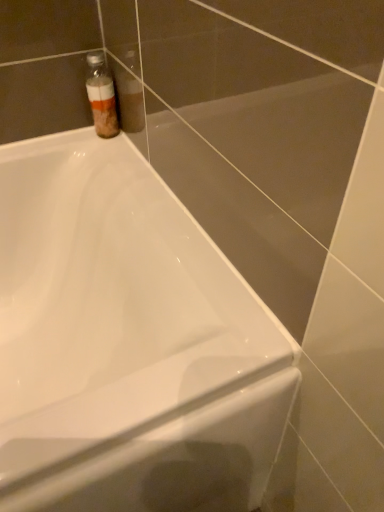
Question: In terms of width, does translucent plastic bottle at upper left look wider or thinner when compared to white glossy bathtub at upper left?

Choices:
 (A) wide
 (B) thin

Answer: (B)

Question: Choose the correct answer: Is translucent plastic bottle at upper left inside white glossy bathtub at upper left or outside it?

Choices:
 (A) outside
 (B) inside

Answer: (A)

Question: Does point (102, 128) appear closer or farther from the camera than point (157, 354)?

Choices:
 (A) closer
 (B) farther

Answer: (B)

Question: In terms of size, does white glossy bathtub at upper left appear bigger or smaller than translucent plastic bottle at upper left?

Choices:
 (A) small
 (B) big

Answer: (B)

Question: Considering the positions of point (124, 197) and point (107, 97), is point (124, 197) closer or farther from the camera than point (107, 97)?

Choices:
 (A) closer
 (B) farther

Answer: (A)

Question: From the image's perspective, relative to translucent plastic bottle at upper left, is white glossy bathtub at upper left above or below?

Choices:
 (A) above
 (B) below

Answer: (B)

Question: Is white glossy bathtub at upper left to the left or to the right of translucent plastic bottle at upper left in the image?

Choices:
 (A) right
 (B) left

Answer: (B)